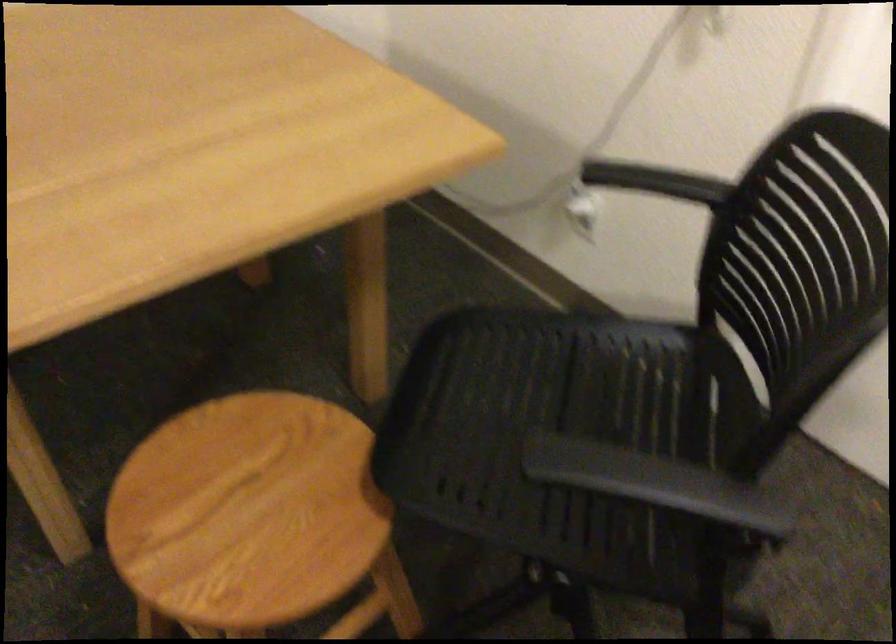
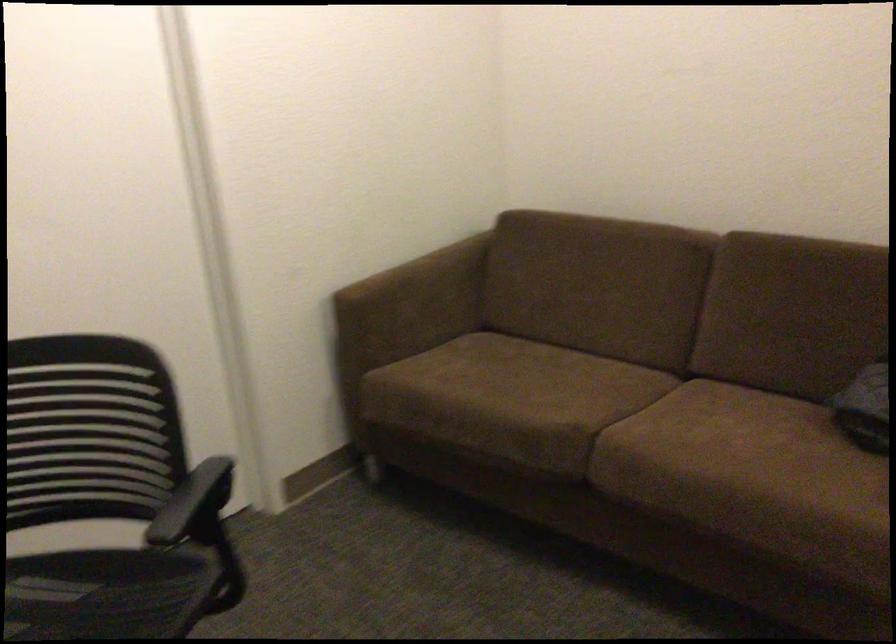
First-person continuous shooting, in which direction is the camera rotating?

The rotation direction of the camera is right-down.